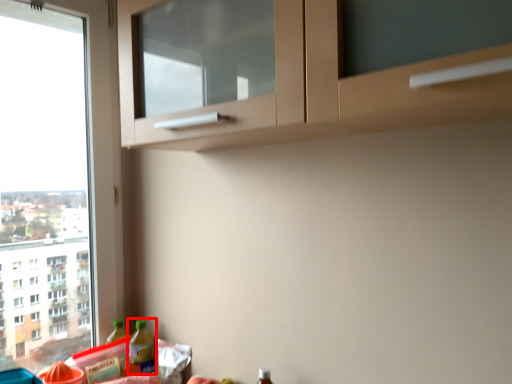
Question: From the image's perspective, what is the correct spatial relationship of bottle (annotated by the red box) in relation to bottle?

Choices:
 (A) above
 (B) below

Answer: (A)